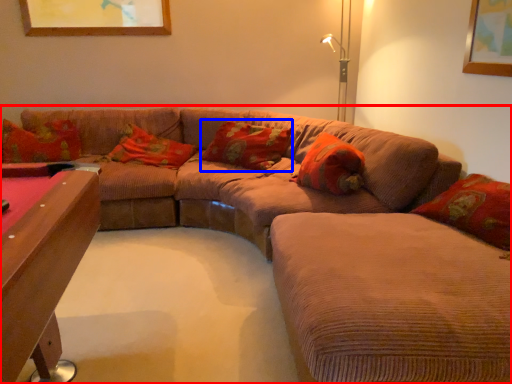
Question: Which of the following is the closest to the observer, studio couch (highlighted by a red box) or pillow (highlighted by a blue box)?

Choices:
 (A) studio couch
 (B) pillow

Answer: (A)